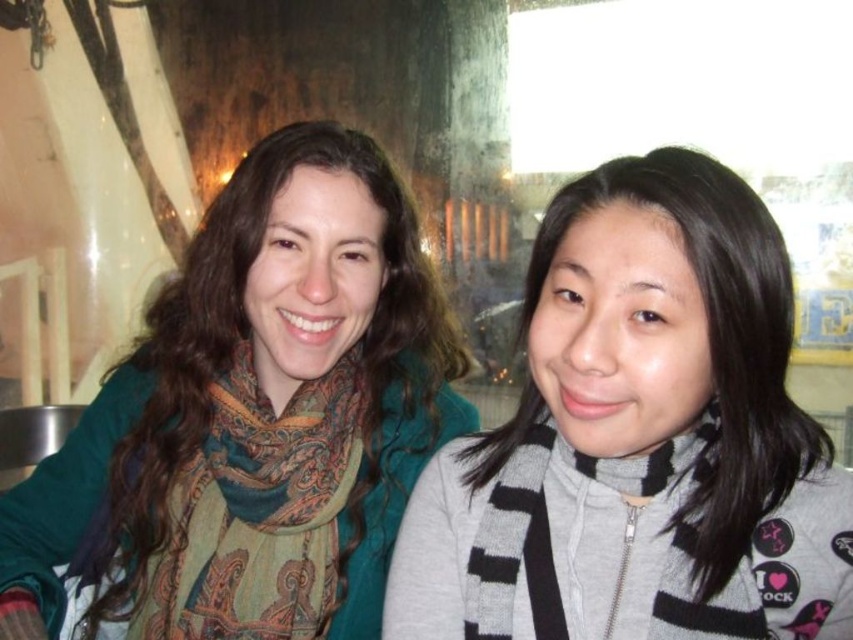
Question: Which object is closer to the camera taking this photo?

Choices:
 (A) gray striped scarf at center
 (B) gray/black striped scarf at right

Answer: (A)

Question: Is paisley-patterned scarf at left to the right of gray/black striped scarf at right from the viewer's perspective?

Choices:
 (A) yes
 (B) no

Answer: (B)

Question: Which point is closer to the camera taking this photo?

Choices:
 (A) (247, 374)
 (B) (334, 449)
 (C) (505, 589)
 (D) (643, 472)

Answer: (D)

Question: Is paisley scarf at left positioned at the back of gray/black striped scarf at right?

Choices:
 (A) yes
 (B) no

Answer: (A)

Question: Can you confirm if paisley scarf at left is smaller than gray/black striped scarf at right?

Choices:
 (A) no
 (B) yes

Answer: (A)

Question: Which object is positioned farthest from the paisley-patterned scarf at left?

Choices:
 (A) gray/black striped scarf at right
 (B) gray striped scarf at center
 (C) paisley scarf at left

Answer: (A)